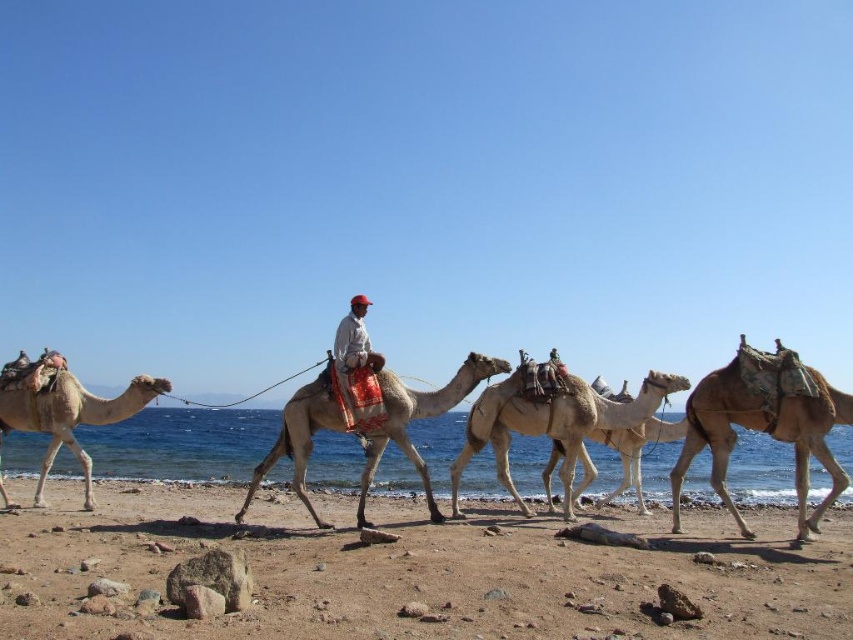
You are standing on the sandy beach and want to take a photo of the light brown textured camel at right and the light brown textured camel at center. Which camel should you focus on first if you want to capture both in the same frame without moving your camera?

You should focus on the light brown textured camel at center first because the light brown textured camel at right is positioned under it, meaning the center camel is closer to the camera and will be in focus first.

You are standing on the sandy beach and see the light brown textured camel at center. If you want to walk directly towards it from your current position, what coordinates should you aim for?

You should aim for the coordinates point (x=416, y=419) where the light brown textured camel at center is located.

You are standing on the sandy beach in the coastal scene. There is a light brown textured camel at center marked by point (416, 419). If you walk straight ahead from your current position, will you reach the camel before reaching the calm sea?

The point (416, 419) marks the light brown textured camel at center, which is closer to you than the calm sea. Therefore, you will reach the camel before reaching the calm sea.